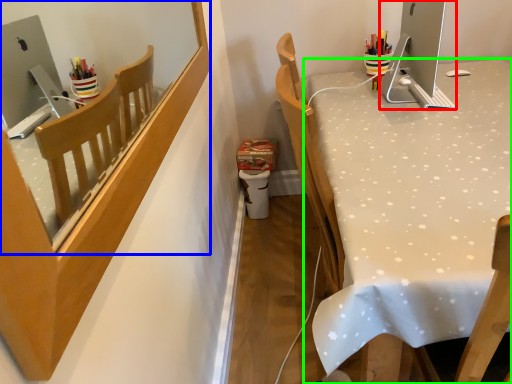
Question: Based on their relative distances, which object is farther from desktop (highlighted by a red box)? Choose from mirror (highlighted by a blue box) and desk (highlighted by a green box).

Choices:
 (A) mirror
 (B) desk

Answer: (A)